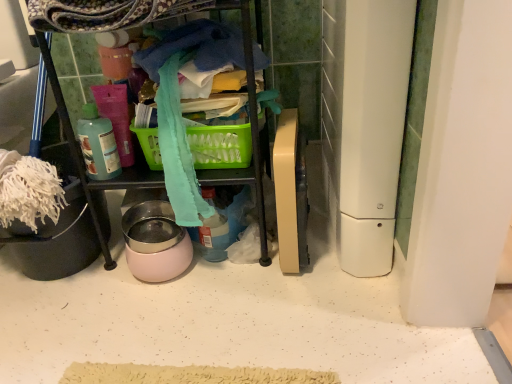
This screenshot has width=512, height=384. I want to click on translucent plastic bottle at upper left, so click(98, 145).

Identify the location of white plastic appliance at right, the 1th appliance when ordered from right to left. (365, 122).

This screenshot has width=512, height=384. What do you see at coordinates (365, 122) in the screenshot? I see `white plastic appliance at right, the 1th appliance when ordered from right to left` at bounding box center [365, 122].

Where is `pink glossy bowl at center, arranged as the 2th appliance when viewed from the right`? pink glossy bowl at center, arranged as the 2th appliance when viewed from the right is located at coordinates (155, 242).

Is white plastic appliance at right, the 2th appliance from the left, turned away from pink glossy bowl at center, arranged as the 2th appliance when viewed from the right?

No, white plastic appliance at right, the 2th appliance from the left,'s orientation is not away from pink glossy bowl at center, arranged as the 2th appliance when viewed from the right.

Are white plastic appliance at right, the 2th appliance from the left, and pink glossy bowl at center, the first appliance when ordered from left to right, located far from each other?

No, white plastic appliance at right, the 2th appliance from the left, is not far away from pink glossy bowl at center, the first appliance when ordered from left to right.

Between white plastic appliance at right, the 1th appliance when ordered from right to left, and pink glossy bowl at center, the first appliance when ordered from left to right, which one has less height?

With less height is pink glossy bowl at center, the first appliance when ordered from left to right.

Considering the positions of point (374, 68) and point (137, 242), is point (374, 68) closer or farther from the camera than point (137, 242)?

Point (374, 68) is closer to the camera than point (137, 242).

Is green plastic picnic basket at center behind pink glossy bowl at center, the first appliance when ordered from left to right?

No.

Is there a large distance between green plastic picnic basket at center and pink glossy bowl at center, the first appliance when ordered from left to right?

green plastic picnic basket at center is actually quite close to pink glossy bowl at center, the first appliance when ordered from left to right.

Is green plastic picnic basket at center outside of pink glossy bowl at center, the first appliance when ordered from left to right?

That's correct, green plastic picnic basket at center is outside of pink glossy bowl at center, the first appliance when ordered from left to right.

Is point (204, 138) positioned before point (147, 220)?

Yes.

Is translucent plastic bottle at upper left located outside green plastic picnic basket at center?

Indeed, translucent plastic bottle at upper left is completely outside green plastic picnic basket at center.

Is translucent plastic bottle at upper left wider or thinner than green plastic picnic basket at center?

translucent plastic bottle at upper left is thinner than green plastic picnic basket at center.

Who is more distant, translucent plastic bottle at upper left or green plastic picnic basket at center?

green plastic picnic basket at center is more distant.

Is translucent plastic bottle at upper left positioned with its back to green plastic picnic basket at center?

No, translucent plastic bottle at upper left is not facing away from green plastic picnic basket at center.

Between pink glossy bowl at center, the first appliance when ordered from left to right, and translucent plastic bottle at upper left, which one appears on the left side from the viewer's perspective?

translucent plastic bottle at upper left.

Does point (147, 253) appear closer or farther from the camera than point (95, 167)?

Point (147, 253) appears to be farther away from the viewer than point (95, 167).

Considering the sizes of objects pink glossy bowl at center, arranged as the 2th appliance when viewed from the right, and translucent plastic bottle at upper left in the image provided, who is thinner, pink glossy bowl at center, arranged as the 2th appliance when viewed from the right, or translucent plastic bottle at upper left?

With smaller width is translucent plastic bottle at upper left.

Is pink glossy bowl at center, arranged as the 2th appliance when viewed from the right, taller than translucent plastic bottle at upper left?

No, pink glossy bowl at center, arranged as the 2th appliance when viewed from the right, is not taller than translucent plastic bottle at upper left.

From the picture: Would you say green plastic picnic basket at center contains translucent plastic bottle at upper left?

No, green plastic picnic basket at center does not contain translucent plastic bottle at upper left.

Which of these two, green plastic picnic basket at center or translucent plastic bottle at upper left, stands taller?

translucent plastic bottle at upper left.

Between point (150, 157) and point (92, 107), which one is positioned behind?

The point (92, 107) is farther from the camera.

Relative to translucent plastic bottle at upper left, is green plastic picnic basket at center in front or behind?

green plastic picnic basket at center is behind translucent plastic bottle at upper left.

Between pink glossy bowl at center, the first appliance when ordered from left to right, and green plastic picnic basket at center, which one appears on the right side from the viewer's perspective?

Positioned to the right is green plastic picnic basket at center.

Looking at this image, does pink glossy bowl at center, the first appliance when ordered from left to right, have a lesser height compared to green plastic picnic basket at center?

Incorrect, the height of pink glossy bowl at center, the first appliance when ordered from left to right, does not fall short of that of green plastic picnic basket at center.

Locate an element on the screen. Image resolution: width=512 pixels, height=384 pixels. picnic basket lying on the right of pink glossy bowl at center, the first appliance when ordered from left to right is located at coordinates (220, 146).

Is pink glossy bowl at center, the first appliance when ordered from left to right, not within green plastic picnic basket at center?

Indeed, pink glossy bowl at center, the first appliance when ordered from left to right, is completely outside green plastic picnic basket at center.

Identify the location of appliance on the right of green plastic picnic basket at center. (365, 122).

Is point (263, 125) closer to camera compared to point (390, 268)?

No, it is behind (390, 268).

Considering the relative positions of green plastic picnic basket at center and white plastic appliance at right, the 1th appliance when ordered from right to left, in the image provided, is green plastic picnic basket at center in front of white plastic appliance at right, the 1th appliance when ordered from right to left,?

No, green plastic picnic basket at center is further to the viewer.

The image size is (512, 384). What are the coordinates of `appliance lying on the left of white plastic appliance at right, the 1th appliance when ordered from right to left` in the screenshot? It's located at (155, 242).

From a real-world perspective, count 2nd appliances downward from the green plastic picnic basket at center and point to it. Please provide its 2D coordinates.

[(155, 242)]

Looking at the image, which one is located further to pink glossy bowl at center, arranged as the 2th appliance when viewed from the right, green plastic picnic basket at center or white plastic appliance at right, the 2th appliance from the left?

white plastic appliance at right, the 2th appliance from the left, is positioned further to the anchor pink glossy bowl at center, arranged as the 2th appliance when viewed from the right.

When comparing their distances from translucent plastic bottle at upper left, does green plastic picnic basket at center or white plastic appliance at right, the 1th appliance when ordered from right to left, seem closer?

The object closer to translucent plastic bottle at upper left is green plastic picnic basket at center.

When comparing their distances from green plastic picnic basket at center, does white plastic appliance at right, the 2th appliance from the left, or translucent plastic bottle at upper left seem closer?

Based on the image, translucent plastic bottle at upper left appears to be nearer to green plastic picnic basket at center.

Considering their positions, is translucent plastic bottle at upper left positioned closer to white plastic appliance at right, the 2th appliance from the left, than pink glossy bowl at center, the first appliance when ordered from left to right?

Based on the image, pink glossy bowl at center, the first appliance when ordered from left to right, appears to be nearer to white plastic appliance at right, the 2th appliance from the left.

Based on the photo, based on their spatial positions, is pink glossy bowl at center, arranged as the 2th appliance when viewed from the right, or white plastic appliance at right, the 1th appliance when ordered from right to left, further from translucent plastic bottle at upper left?

white plastic appliance at right, the 1th appliance when ordered from right to left, is further to translucent plastic bottle at upper left.

Looking at the image, which one is located further to green plastic picnic basket at center, translucent plastic bottle at upper left or white plastic appliance at right, the 1th appliance when ordered from right to left?

white plastic appliance at right, the 1th appliance when ordered from right to left, lies further to green plastic picnic basket at center than the other object.

Considering their positions, is white plastic appliance at right, the 2th appliance from the left, positioned further to green plastic picnic basket at center than pink glossy bowl at center, arranged as the 2th appliance when viewed from the right?

The object further to green plastic picnic basket at center is white plastic appliance at right, the 2th appliance from the left.

Based on their spatial positions, is translucent plastic bottle at upper left or green plastic picnic basket at center further from white plastic appliance at right, the 2th appliance from the left?

translucent plastic bottle at upper left lies further to white plastic appliance at right, the 2th appliance from the left, than the other object.

Image resolution: width=512 pixels, height=384 pixels. What are the coordinates of `picnic basket situated between translucent plastic bottle at upper left and white plastic appliance at right, the 1th appliance when ordered from right to left, from left to right` in the screenshot? It's located at (220, 146).

Locate an element on the screen. bottle that lies between green plastic picnic basket at center and pink glossy bowl at center, the first appliance when ordered from left to right, from top to bottom is located at coordinates (98, 145).

Locate an element on the screen. The width and height of the screenshot is (512, 384). picnic basket situated between pink glossy bowl at center, the first appliance when ordered from left to right, and white plastic appliance at right, the 2th appliance from the left, from left to right is located at coordinates (220, 146).

Identify the location of appliance between translucent plastic bottle at upper left and white plastic appliance at right, the 2th appliance from the left, from left to right. (155, 242).